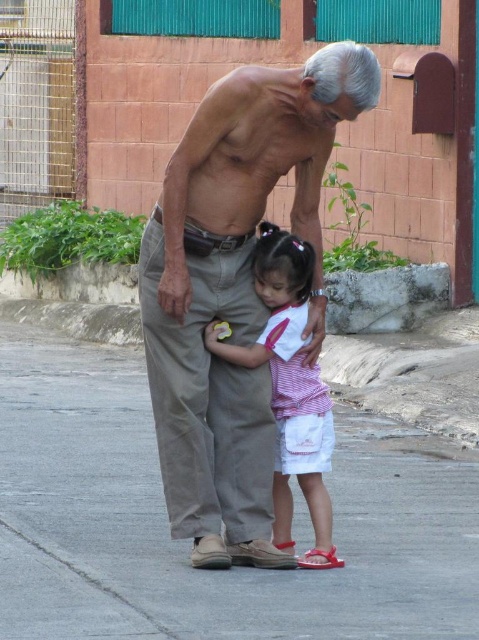
Question: Which object appears closest to the camera in this image?

Choices:
 (A) gray concrete pavement at center
 (B) tan cotton pants at center

Answer: (B)

Question: Is gray concrete pavement at center above tan cotton pants at center?

Choices:
 (A) no
 (B) yes

Answer: (A)

Question: Among these objects, which one is nearest to the camera?

Choices:
 (A) gray concrete pavement at center
 (B) tan cotton pants at center
 (C) striped cotton shirt at center

Answer: (B)

Question: Which point is closer to the camera taking this photo?

Choices:
 (A) (83, 353)
 (B) (284, 90)

Answer: (B)

Question: Does gray concrete pavement at center appear on the left side of tan cotton pants at center?

Choices:
 (A) no
 (B) yes

Answer: (B)

Question: Does tan cotton pants at center have a lesser width compared to striped cotton shirt at center?

Choices:
 (A) yes
 (B) no

Answer: (B)